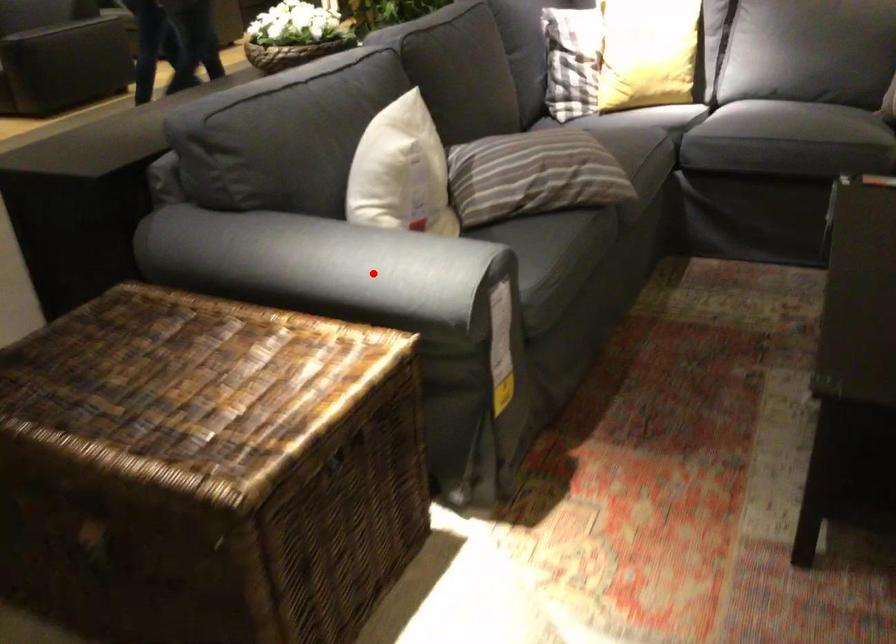
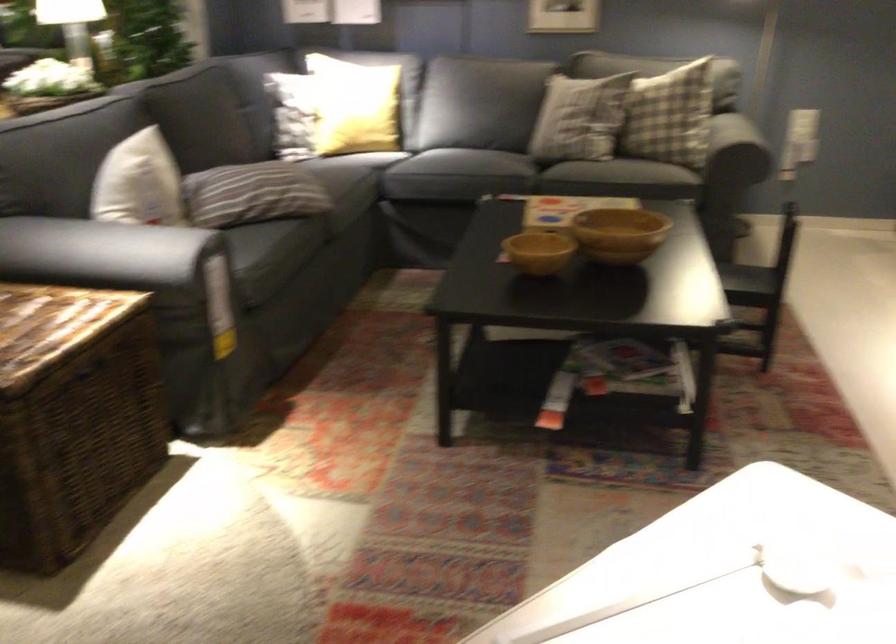
In the second image, find the point that corresponds to the highlighted location in the first image.

(117, 252)